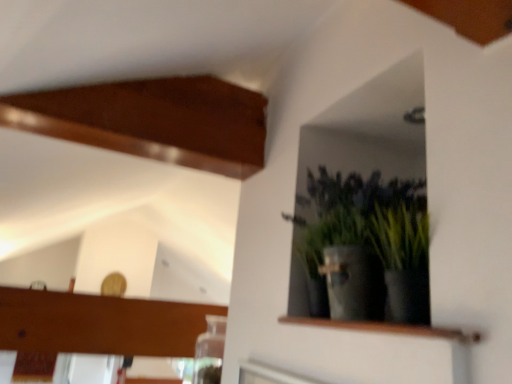
Question: Is green matte plant at upper right shorter than wooden shelf at upper right?

Choices:
 (A) yes
 (B) no

Answer: (B)

Question: Would you say green matte plant at upper right is a long distance from wooden shelf at upper right?

Choices:
 (A) no
 (B) yes

Answer: (A)

Question: From the image's perspective, is green matte plant at upper right under wooden shelf at upper right?

Choices:
 (A) yes
 (B) no

Answer: (B)

Question: Is green matte plant at upper right positioned with its back to wooden shelf at upper right?

Choices:
 (A) no
 (B) yes

Answer: (A)

Question: Is green matte plant at upper right aimed at wooden shelf at upper right?

Choices:
 (A) yes
 (B) no

Answer: (B)

Question: Can you confirm if green matte plant at upper right is thinner than wooden shelf at upper right?

Choices:
 (A) yes
 (B) no

Answer: (B)

Question: Is wooden shelf at upper right placed right next to green matte plant at upper right?

Choices:
 (A) yes
 (B) no

Answer: (B)

Question: Is wooden shelf at upper right shorter than green matte plant at upper right?

Choices:
 (A) yes
 (B) no

Answer: (A)

Question: Is wooden shelf at upper right further to the viewer compared to green matte plant at upper right?

Choices:
 (A) yes
 (B) no

Answer: (B)

Question: Is wooden shelf at upper right bigger than green matte plant at upper right?

Choices:
 (A) no
 (B) yes

Answer: (A)

Question: From the image's perspective, is wooden shelf at upper right over green matte plant at upper right?

Choices:
 (A) no
 (B) yes

Answer: (A)

Question: From a real-world perspective, is wooden shelf at upper right beneath green matte plant at upper right?

Choices:
 (A) yes
 (B) no

Answer: (A)

Question: Looking at the image, does green matte plant at upper right seem bigger or smaller compared to wooden shelf at upper right?

Choices:
 (A) small
 (B) big

Answer: (B)